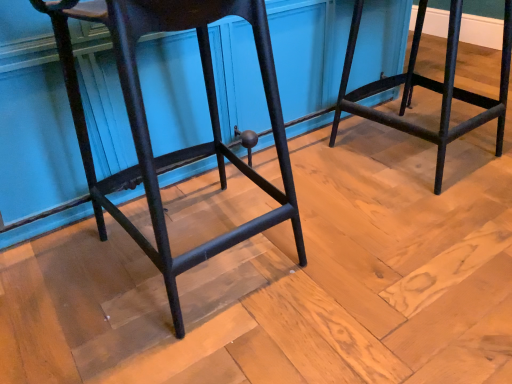
Image resolution: width=512 pixels, height=384 pixels. I want to click on vacant area that lies between matte black stool at center, the 2th furniture from the right, and black metal stool at right, the second furniture viewed from the left, so click(334, 192).